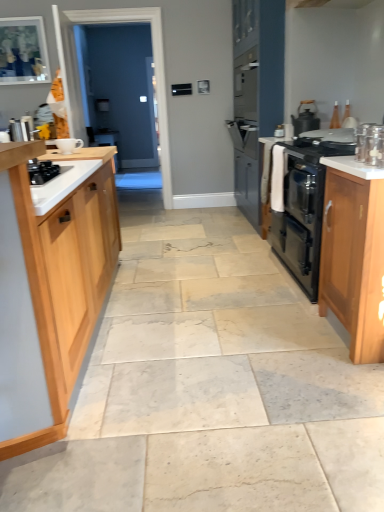
Question: Can you confirm if black matte gas stove at left is positioned to the left of metallic silver kettle at left, the second appliance from the front?

Choices:
 (A) no
 (B) yes

Answer: (A)

Question: Is black matte gas stove at left oriented away from metallic silver kettle at left, which ranks as the second appliance in right-to-left order?

Choices:
 (A) yes
 (B) no

Answer: (B)

Question: Does black matte gas stove at left have a greater width compared to metallic silver kettle at left, which ranks as the second appliance in right-to-left order?

Choices:
 (A) no
 (B) yes

Answer: (B)

Question: Is black matte gas stove at left not inside metallic silver kettle at left, the second appliance from the front?

Choices:
 (A) yes
 (B) no

Answer: (A)

Question: Does black matte gas stove at left have a smaller size compared to metallic silver kettle at left, placed as the second appliance when sorted from bottom to top?

Choices:
 (A) yes
 (B) no

Answer: (B)

Question: Considering the positions of clear glass jar at upper right, acting as the second kitchen appliance starting from the back, and black matte gas stove at left in the image, is clear glass jar at upper right, acting as the second kitchen appliance starting from the back, bigger or smaller than black matte gas stove at left?

Choices:
 (A) big
 (B) small

Answer: (B)

Question: In the image, is clear glass jar at upper right, marked as the first kitchen appliance in a front-to-back arrangement, on the left side or the right side of black matte gas stove at left?

Choices:
 (A) left
 (B) right

Answer: (B)

Question: From the image's perspective, is clear glass jar at upper right, which is the 2th kitchen appliance in top-to-bottom order, positioned above or below black matte gas stove at left?

Choices:
 (A) below
 (B) above

Answer: (B)

Question: In terms of height, does clear glass jar at upper right, the first kitchen appliance when ordered from bottom to top, look taller or shorter compared to black matte gas stove at left?

Choices:
 (A) tall
 (B) short

Answer: (A)

Question: Is transparent glass door at center bigger or smaller than white ceramic cup at upper left, which appears as the first appliance when ordered from the bottom?

Choices:
 (A) big
 (B) small

Answer: (A)

Question: Is point (102, 93) closer or farther from the camera than point (71, 145)?

Choices:
 (A) farther
 (B) closer

Answer: (A)

Question: From the image's perspective, relative to white ceramic cup at upper left, placed as the first appliance when sorted from right to left, is transparent glass door at center above or below?

Choices:
 (A) below
 (B) above

Answer: (B)

Question: Is transparent glass door at center situated inside white ceramic cup at upper left, placed as the first appliance when sorted from right to left, or outside?

Choices:
 (A) inside
 (B) outside

Answer: (B)

Question: From a real-world perspective, is transparent glass door at center physically located above or below light wood cabinet at right, marked as the second cabinetry in a left-to-right arrangement?

Choices:
 (A) below
 (B) above

Answer: (B)

Question: Which is correct: transparent glass door at center is inside light wood cabinet at right, marked as the second cabinetry in a left-to-right arrangement, or outside of it?

Choices:
 (A) inside
 (B) outside

Answer: (B)